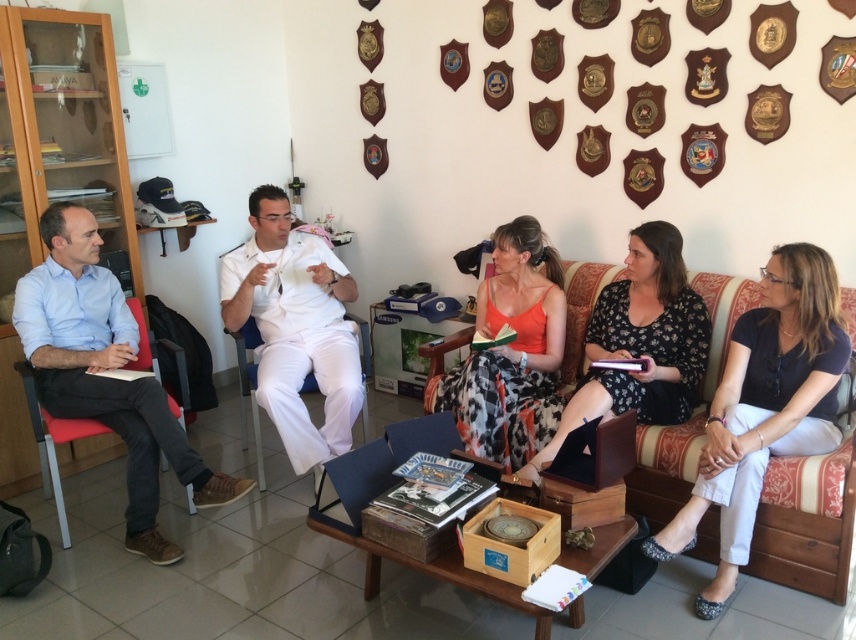
You are standing at the entrance of the room and notice the white matte uniform at center. Based on its position coordinates, can you determine if it is closer to the left or right side of the room?

The white matte uniform at center is located at point 0.512 on the x and y axis, which places it near the center of the room. Therefore, it is neither closer to the left nor the right side.

Consider the image. You are a photographer preparing to take a group photo of the meeting participants. You notice the wooden couch at lower right and the orange fabric dress at center. Which object is taller?

The wooden couch at lower right is taller than the orange fabric dress at center.